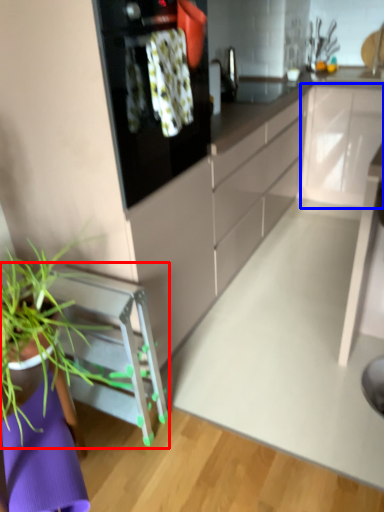
Question: Which object appears closest to the camera in this image, furniture (highlighted by a red box) or cabinetry (highlighted by a blue box)?

Choices:
 (A) furniture
 (B) cabinetry

Answer: (A)